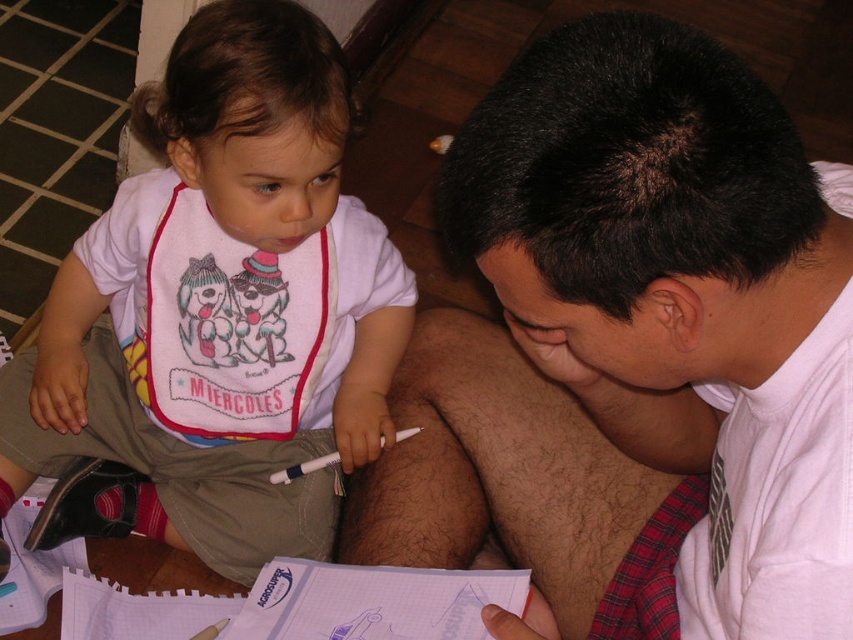
You are a photographer trying to capture a closeup of the white shirt at upper right and the white cotton bib at upper left. Which object should you zoom in on first to ensure it fits entirely in the frame?

The white shirt at upper right has a lesser width compared to white cotton bib at upper left, so you should zoom in on the white shirt at upper right first to ensure it fits entirely in the frame before adjusting for the wider bib.

You are a photographer trying to capture a closeup of the white cotton bib at upper left and the white shirt at upper right. Since both are white, you want to ensure they are clearly distinguishable in the photo. Based on their positions, which object should you focus on first to ensure it appears sharp in the image?

The white cotton bib at upper left should be focused on first because it is higher up and closer to the camera than the white shirt at upper right, which is located below it.

You are a toy delivery robot and you need to place a small toy between the white shirt at upper right and the white cotton bib at upper left. Can you fit the toy in between them?

The distance between the white shirt at upper right and the white cotton bib at upper left is 14.23 inches. Since the toy is small, it can easily fit in the space between them.